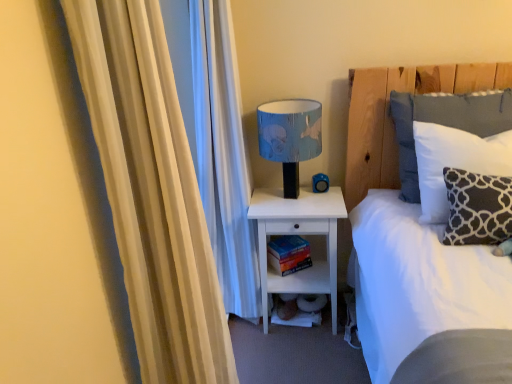
Question: Is hardcover book at lower center not inside white matte nightstand at lower center?

Choices:
 (A) no
 (B) yes

Answer: (A)

Question: From the image's perspective, is hardcover book at lower center on white matte nightstand at lower center?

Choices:
 (A) yes
 (B) no

Answer: (A)

Question: Is hardcover book at lower center taller than white matte nightstand at lower center?

Choices:
 (A) yes
 (B) no

Answer: (B)

Question: Is white matte nightstand at lower center surrounded by hardcover book at lower center?

Choices:
 (A) no
 (B) yes

Answer: (A)

Question: Does hardcover book at lower center have a lesser height compared to white matte nightstand at lower center?

Choices:
 (A) no
 (B) yes

Answer: (B)

Question: From a real-world perspective, is hardcover book at lower center under white matte nightstand at lower center?

Choices:
 (A) yes
 (B) no

Answer: (A)

Question: Considering the relative sizes of white cotton pillow at upper right, marked as the first pillow in a back-to-front arrangement, and hardcover book at lower center in the image provided, is white cotton pillow at upper right, marked as the first pillow in a back-to-front arrangement, taller than hardcover book at lower center?

Choices:
 (A) no
 (B) yes

Answer: (B)

Question: Is white cotton pillow at upper right, which is the second pillow from front to back, outside hardcover book at lower center?

Choices:
 (A) no
 (B) yes

Answer: (B)

Question: Is white cotton pillow at upper right, marked as the first pillow in a back-to-front arrangement, shorter than hardcover book at lower center?

Choices:
 (A) yes
 (B) no

Answer: (B)

Question: From the image's perspective, is white cotton pillow at upper right, which is the second pillow from front to back, below hardcover book at lower center?

Choices:
 (A) no
 (B) yes

Answer: (A)

Question: Does white cotton pillow at upper right, marked as the first pillow in a back-to-front arrangement, appear on the left side of hardcover book at lower center?

Choices:
 (A) yes
 (B) no

Answer: (B)

Question: From a real-world perspective, is white cotton pillow at upper right, marked as the first pillow in a back-to-front arrangement, physically above hardcover book at lower center?

Choices:
 (A) yes
 (B) no

Answer: (A)

Question: Could you tell me if dark gray fabric pillow at right, which is the 2th pillow from back to front, is turned towards white soft bed at upper right?

Choices:
 (A) no
 (B) yes

Answer: (B)